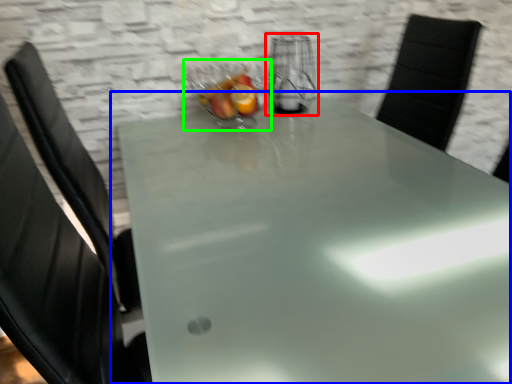
Question: Based on their relative distances, which object is nearer to appliance (highlighted by a red box)? Choose from table (highlighted by a blue box) and glass bowl (highlighted by a green box).

Choices:
 (A) table
 (B) glass bowl

Answer: (B)